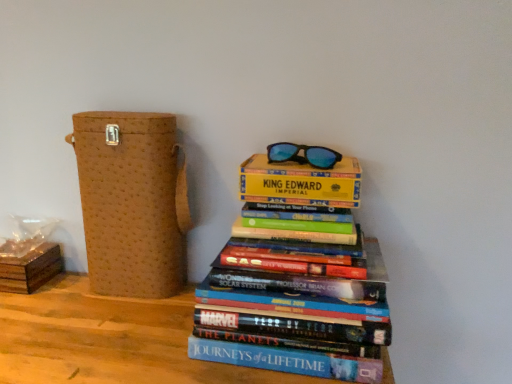
Describe the element at coordinates (295, 308) in the screenshot. I see `hardcover books at center` at that location.

In order to face hardcover books at center, should I rotate leftwards or rightwards?

Turn right approximately 5.299 degrees to face it.

The height and width of the screenshot is (384, 512). I want to click on hardcover books at center, so click(295, 308).

Considering the positions of objects blue reflective lenses at upper center and hardcover books at center in the image provided, who is more to the right, blue reflective lenses at upper center or hardcover books at center?

→ Positioned to the right is blue reflective lenses at upper center.

Between blue reflective lenses at upper center and hardcover books at center, which one has more height?

With more height is hardcover books at center.

From the picture: Is blue reflective lenses at upper center not near hardcover books at center?

They are positioned close to each other.

Can we say brown cardboard box at lower left, the 2th cardboard box from the right, lies outside blue reflective lenses at upper center?

Absolutely, brown cardboard box at lower left, the 2th cardboard box from the right, is external to blue reflective lenses at upper center.

How different are the orientations of brown cardboard box at lower left, which is counted as the 1th cardboard box, starting from the left, and blue reflective lenses at upper center in degrees?

There is a 0.369-degree angle between the facing directions of brown cardboard box at lower left, which is counted as the 1th cardboard box, starting from the left, and blue reflective lenses at upper center.

Consider the image. Is brown cardboard box at lower left, which is counted as the 1th cardboard box, starting from the left, thinner than blue reflective lenses at upper center?

No.

Is point (26, 288) closer or farther from the camera than point (313, 158)?

Point (26, 288) appears to be farther away from the viewer than point (313, 158).

Can you tell me how much blue reflective lenses at upper center and brown textured box at left, the second cardboard box in the left-to-right sequence, differ in facing direction?

2.5 degrees separate the facing orientations of blue reflective lenses at upper center and brown textured box at left, the second cardboard box in the left-to-right sequence.

Is there a large distance between blue reflective lenses at upper center and brown textured box at left, the second cardboard box in the left-to-right sequence?

No, blue reflective lenses at upper center is in close proximity to brown textured box at left, the second cardboard box in the left-to-right sequence.

Is blue reflective lenses at upper center completely or partially outside of brown textured box at left, the first cardboard box from the right?

Absolutely, blue reflective lenses at upper center is external to brown textured box at left, the first cardboard box from the right.

Is blue reflective lenses at upper center to the left or to the right of brown textured box at left, the first cardboard box from the right, in the image?

Clearly, blue reflective lenses at upper center is on the right of brown textured box at left, the first cardboard box from the right, in the image.

From a real-world perspective, is hardcover books at center located beneath brown textured box at left, the second cardboard box in the left-to-right sequence?

Yes, from a real-world perspective, hardcover books at center is under brown textured box at left, the second cardboard box in the left-to-right sequence.

Visually, is hardcover books at center positioned to the left or to the right of brown textured box at left, the first cardboard box from the right?

Clearly, hardcover books at center is on the right of brown textured box at left, the first cardboard box from the right, in the image.

Considering the sizes of objects hardcover books at center and brown textured box at left, the second cardboard box in the left-to-right sequence, in the image provided, who is shorter, hardcover books at center or brown textured box at left, the second cardboard box in the left-to-right sequence,?

hardcover books at center is shorter.

From the image's perspective, is hardcover books at center located beneath brown textured box at left, the first cardboard box from the right?

Yes, from the image's perspective, hardcover books at center is beneath brown textured box at left, the first cardboard box from the right.

From the image's perspective, between brown textured box at left, the second cardboard box in the left-to-right sequence, and blue reflective lenses at upper center, which one is located above?

blue reflective lenses at upper center is shown above in the image.

Is brown textured box at left, the second cardboard box in the left-to-right sequence, taller or shorter than blue reflective lenses at upper center?

brown textured box at left, the second cardboard box in the left-to-right sequence, is taller than blue reflective lenses at upper center.

Is point (165, 207) closer to viewer compared to point (319, 166)?

No, it is not.

Is brown textured box at left, the first cardboard box from the right, inside or outside of blue reflective lenses at upper center?

brown textured box at left, the first cardboard box from the right, exists outside the volume of blue reflective lenses at upper center.

Is brown cardboard box at lower left, the 2th cardboard box from the right, not near brown textured box at left, the second cardboard box in the left-to-right sequence?

No, brown cardboard box at lower left, the 2th cardboard box from the right, is in close proximity to brown textured box at left, the second cardboard box in the left-to-right sequence.

Is brown cardboard box at lower left, which is counted as the 1th cardboard box, starting from the left, facing towards brown textured box at left, the second cardboard box in the left-to-right sequence?

No, brown cardboard box at lower left, which is counted as the 1th cardboard box, starting from the left, is not aimed at brown textured box at left, the second cardboard box in the left-to-right sequence.

Between brown cardboard box at lower left, the 2th cardboard box from the right, and brown textured box at left, the first cardboard box from the right, which one has larger size?

brown textured box at left, the first cardboard box from the right, is bigger.

From the image's perspective, would you say brown cardboard box at lower left, which is counted as the 1th cardboard box, starting from the left, is shown under brown textured box at left, the first cardboard box from the right?

Yes, from the image's perspective, brown cardboard box at lower left, which is counted as the 1th cardboard box, starting from the left, is beneath brown textured box at left, the first cardboard box from the right.

Which is behind, point (319, 321) or point (12, 284)?

Positioned behind is point (12, 284).

Considering the relative sizes of hardcover books at center and brown cardboard box at lower left, the 2th cardboard box from the right, in the image provided, is hardcover books at center bigger than brown cardboard box at lower left, the 2th cardboard box from the right,?

Yes.

Is brown cardboard box at lower left, the 2th cardboard box from the right, at the back of hardcover books at center?

No, hardcover books at center is not facing away from brown cardboard box at lower left, the 2th cardboard box from the right.

The height and width of the screenshot is (384, 512). I want to click on book above the brown cardboard box at lower left, the 2th cardboard box from the right (from a real-world perspective), so click(x=295, y=308).

In order to click on glasses that appears behind the hardcover books at center in this screenshot , I will do `click(303, 156)`.

Locate an element on the screen. The height and width of the screenshot is (384, 512). glasses above the brown cardboard box at lower left, the 2th cardboard box from the right (from a real-world perspective) is located at coordinates (303, 156).

Based on their spatial positions, is hardcover books at center or blue reflective lenses at upper center closer to brown textured box at left, the first cardboard box from the right?

Based on the image, hardcover books at center appears to be nearer to brown textured box at left, the first cardboard box from the right.

Estimate the real-world distances between objects in this image. Which object is closer to hardcover books at center, brown cardboard box at lower left, which is counted as the 1th cardboard box, starting from the left, or blue reflective lenses at upper center?

blue reflective lenses at upper center is positioned closer to the anchor hardcover books at center.

Estimate the real-world distances between objects in this image. Which object is closer to hardcover books at center, brown textured box at left, the first cardboard box from the right, or brown cardboard box at lower left, which is counted as the 1th cardboard box, starting from the left?

brown textured box at left, the first cardboard box from the right.

Estimate the real-world distances between objects in this image. Which object is further from blue reflective lenses at upper center, brown textured box at left, the second cardboard box in the left-to-right sequence, or hardcover books at center?

The object further to blue reflective lenses at upper center is brown textured box at left, the second cardboard box in the left-to-right sequence.

From the image, which object appears to be farther from blue reflective lenses at upper center, brown textured box at left, the first cardboard box from the right, or brown cardboard box at lower left, the 2th cardboard box from the right?

brown cardboard box at lower left, the 2th cardboard box from the right.

Based on their spatial positions, is brown textured box at left, the second cardboard box in the left-to-right sequence, or blue reflective lenses at upper center further from brown cardboard box at lower left, which is counted as the 1th cardboard box, starting from the left?

blue reflective lenses at upper center is positioned further to the anchor brown cardboard box at lower left, which is counted as the 1th cardboard box, starting from the left.

Estimate the real-world distances between objects in this image. Which object is closer to hardcover books at center, blue reflective lenses at upper center or brown cardboard box at lower left, the 2th cardboard box from the right?

blue reflective lenses at upper center lies closer to hardcover books at center than the other object.

Estimate the real-world distances between objects in this image. Which object is closer to brown cardboard box at lower left, the 2th cardboard box from the right, blue reflective lenses at upper center or brown textured box at left, the first cardboard box from the right?

The object closer to brown cardboard box at lower left, the 2th cardboard box from the right, is brown textured box at left, the first cardboard box from the right.

Where is `cardboard box situated between brown cardboard box at lower left, which is counted as the 1th cardboard box, starting from the left, and hardcover books at center from left to right`? cardboard box situated between brown cardboard box at lower left, which is counted as the 1th cardboard box, starting from the left, and hardcover books at center from left to right is located at coordinates (132, 202).

Where is `cardboard box located between brown cardboard box at lower left, which is counted as the 1th cardboard box, starting from the left, and blue reflective lenses at upper center in the left-right direction`? The width and height of the screenshot is (512, 384). cardboard box located between brown cardboard box at lower left, which is counted as the 1th cardboard box, starting from the left, and blue reflective lenses at upper center in the left-right direction is located at coordinates (132, 202).

Locate an element on the screen. This screenshot has height=384, width=512. book between brown cardboard box at lower left, which is counted as the 1th cardboard box, starting from the left, and blue reflective lenses at upper center is located at coordinates (295, 308).

Identify the location of book between brown textured box at left, the first cardboard box from the right, and blue reflective lenses at upper center from left to right. (295, 308).